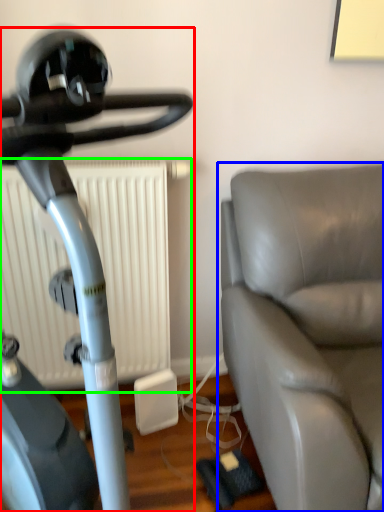
Question: Estimate the real-world distances between objects in this image. Which object is closer to stationary bicycle (highlighted by a red box), studio couch (highlighted by a blue box) or radiator (highlighted by a green box)?

Choices:
 (A) studio couch
 (B) radiator

Answer: (A)